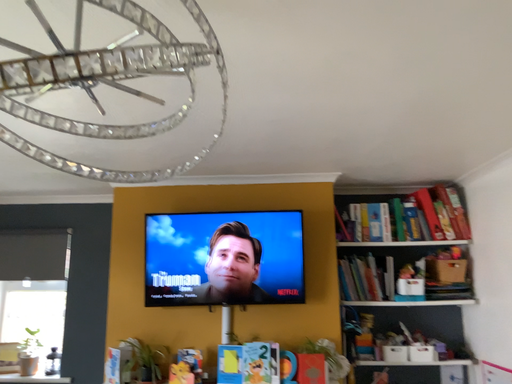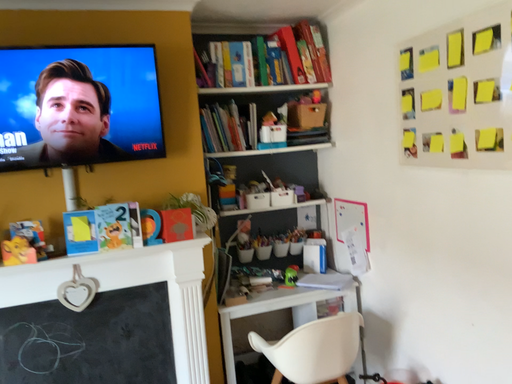
Question: How did the camera likely rotate when shooting the video?

Choices:
 (A) rotated upward
 (B) rotated downward

Answer: (B)